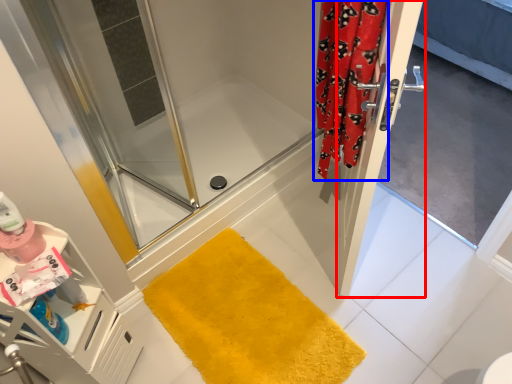
Question: Which point is closer to the camera, door (highlighted by a red box) or shower curtain (highlighted by a blue box)?

Choices:
 (A) door
 (B) shower curtain

Answer: (A)